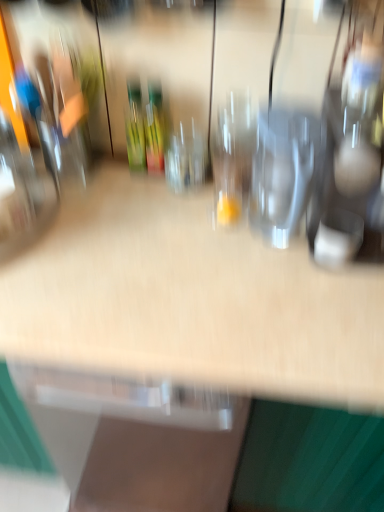
At what (x,y) coordinates should I click in order to perform the action: click on blank area to the left of transparent glass at center, which appears as the second wine glass when viewed from the left. Please return your answer as a coordinate pair (x, y). The width and height of the screenshot is (384, 512). Looking at the image, I should click on (152, 198).